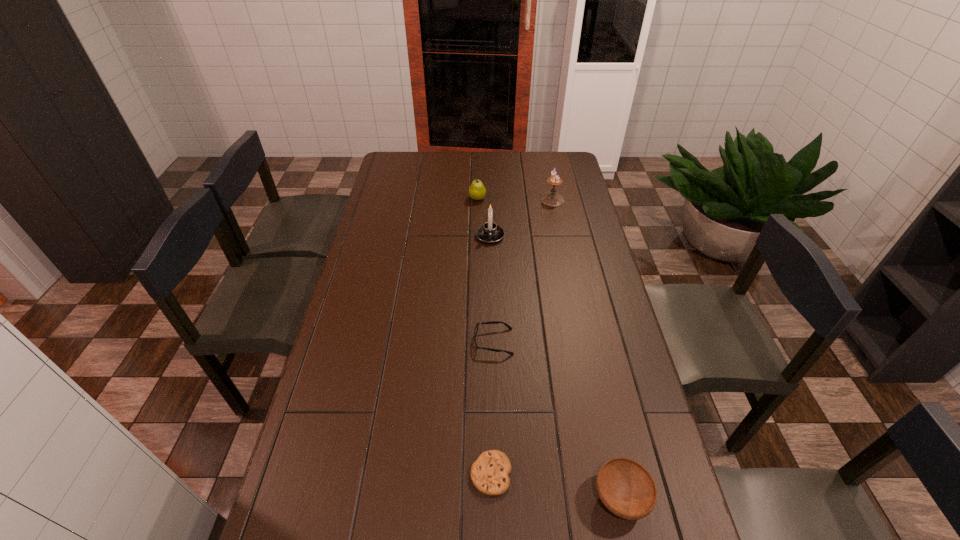
The width and height of the screenshot is (960, 540). I want to click on vacant space located on the back of the third tallest object, so click(478, 152).

Where is `free spot located on the back of the bowl`? This screenshot has width=960, height=540. free spot located on the back of the bowl is located at coordinates (603, 414).

Find the location of a particular element. vacant space situated 0.100m on the front-facing side of the second shortest object is located at coordinates (443, 342).

Where is `vacant position located 0.080m on the front-facing side of the second shortest object`? The image size is (960, 540). vacant position located 0.080m on the front-facing side of the second shortest object is located at coordinates (449, 342).

You are a GUI agent. You are given a task and a screenshot of the screen. Output one action in this format:
    pyautogui.click(x=<x>, y=<y>)
    Task: Click on the free spot located on the front-facing side of the second shortest object
    The image size is (960, 540).
    Given the screenshot: What is the action you would take?
    pyautogui.click(x=398, y=342)

I want to click on vacant space located 0.080m on the left of the shortest object, so click(x=438, y=474).

At what (x,y) coordinates should I click in order to perform the action: click on candle holder present at the right edge. Please return your answer as a coordinate pair (x, y). The image size is (960, 540). Looking at the image, I should click on (552, 199).

You are a GUI agent. You are given a task and a screenshot of the screen. Output one action in this format:
    pyautogui.click(x=<x>, y=<y>)
    Task: Click on the bowl that is at the right edge
    
    Given the screenshot: What is the action you would take?
    pyautogui.click(x=626, y=488)

You are a GUI agent. You are given a task and a screenshot of the screen. Output one action in this format:
    pyautogui.click(x=<x>, y=<y>)
    Task: Click on the free spot at the far edge of the desktop
    Image resolution: width=960 pixels, height=540 pixels.
    Given the screenshot: What is the action you would take?
    pyautogui.click(x=490, y=166)

Find the location of `vacant area at the left edge`. vacant area at the left edge is located at coordinates (394, 234).